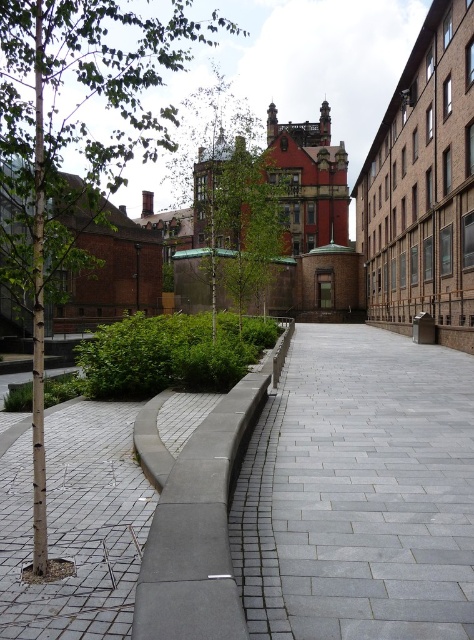
Between point (45, 70) and point (227, 604), which one is positioned in front?

Positioned in front is point (227, 604).

Is the position of bark-textured tree at left more distant than that of concrete at center?

Yes, bark-textured tree at left is behind concrete at center.

The height and width of the screenshot is (640, 474). I want to click on bark-textured tree at left, so click(x=74, y=138).

Between gray concrete alley at center and gray cobblestone pavement at lower left, which one is positioned higher?

gray concrete alley at center

The image size is (474, 640). Describe the element at coordinates (358, 492) in the screenshot. I see `gray concrete alley at center` at that location.

Where is `gray concrete alley at center`? This screenshot has height=640, width=474. gray concrete alley at center is located at coordinates (358, 492).

Who is more forward, (122,497) or (226,499)?

Positioned in front is point (226,499).

Does gray cobblestone pavement at lower left have a greater width compared to concrete at center?

Yes, gray cobblestone pavement at lower left is wider than concrete at center.

Where is `gray cobblestone pavement at lower left`? gray cobblestone pavement at lower left is located at coordinates (75, 525).

Locate an element on the screen. gray cobblestone pavement at lower left is located at coordinates (75, 525).